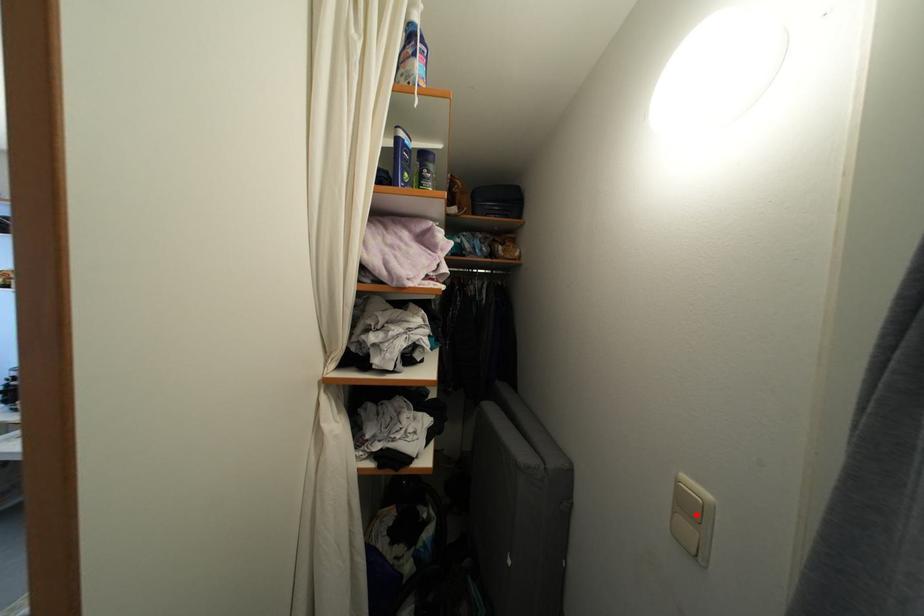
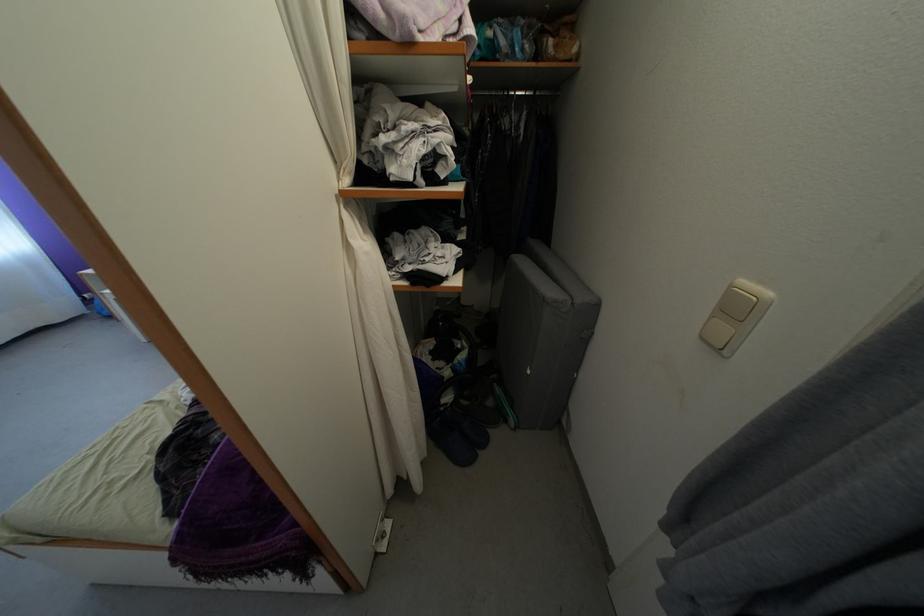
The point at the highlighted location is marked in the first image. Where is the corresponding point in the second image?

(743, 315)